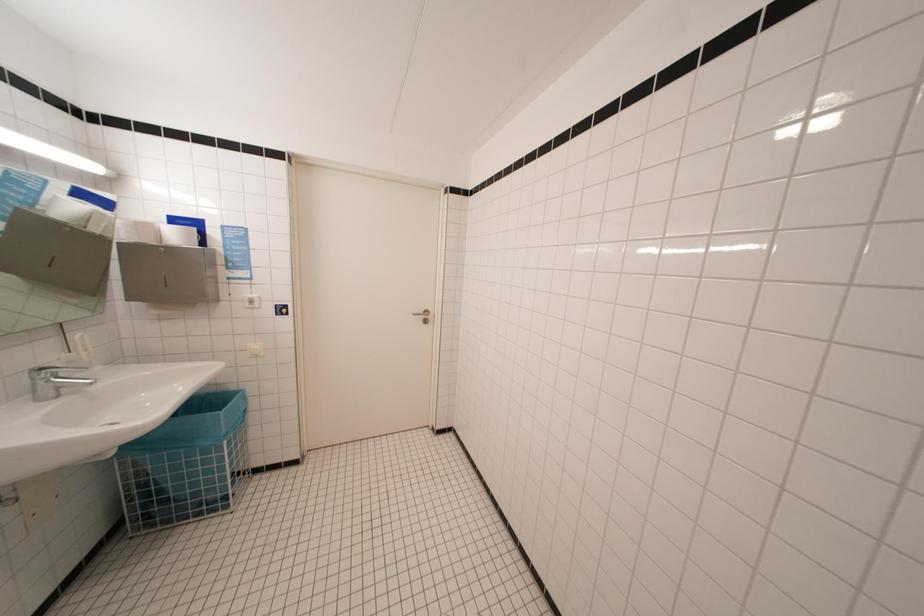
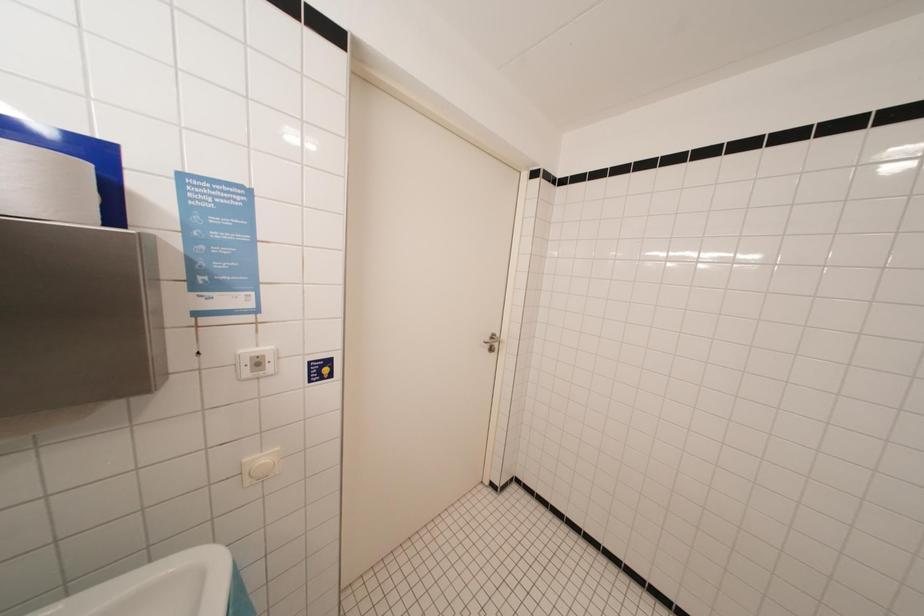
The images are taken continuously from a first-person perspective. In which direction are you moving?

The cameraman walked toward left, forward.